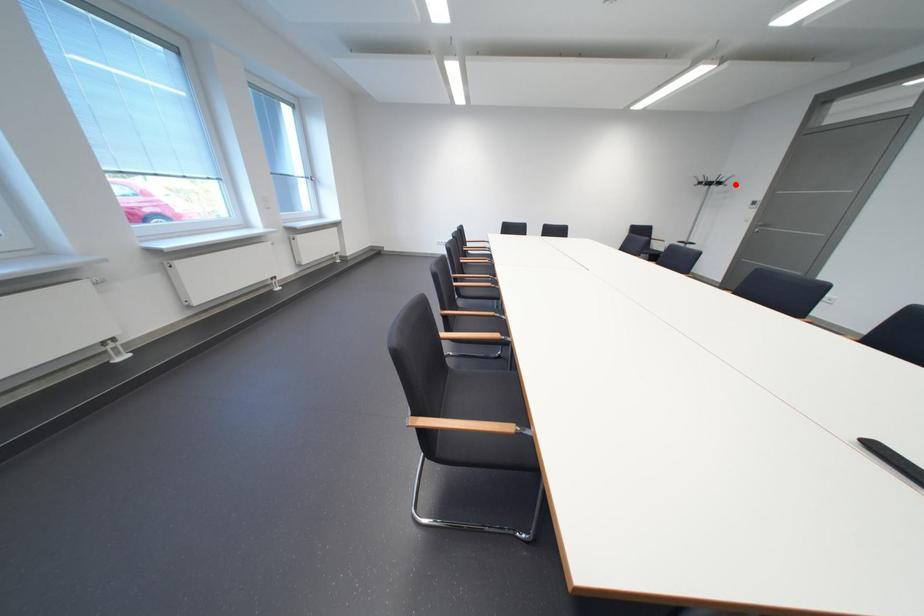
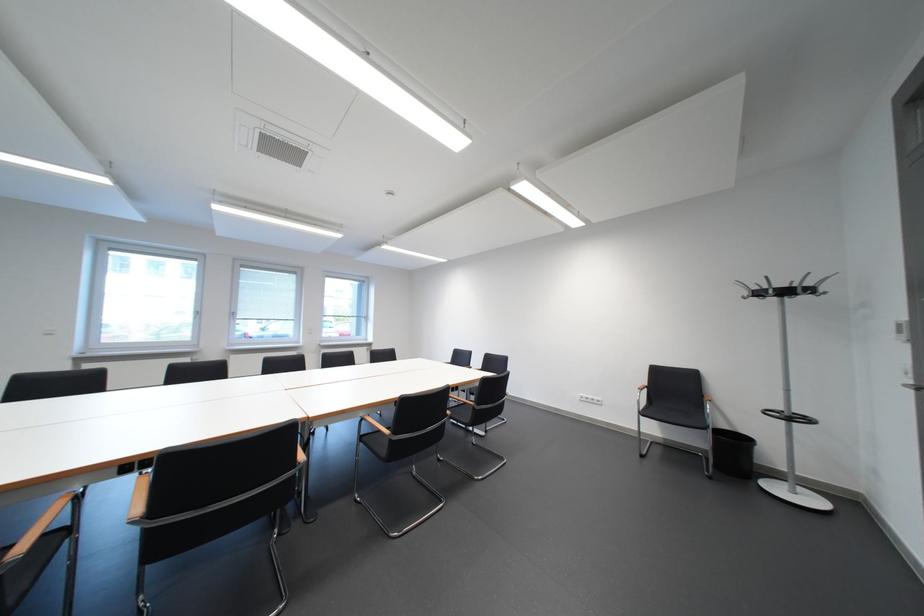
Where in the second image is the point corresponding to the highlighted location from the first image?

(823, 292)